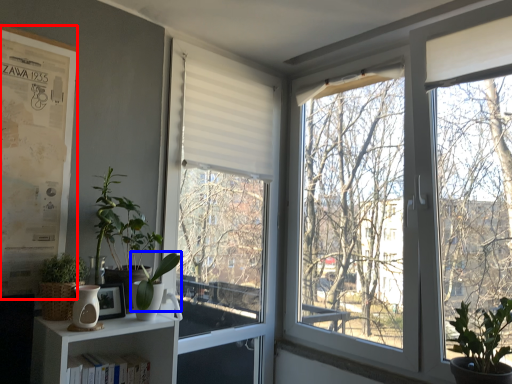
Question: Which object is further to the camera taking this photo, bulletin board (highlighted by a red box) or plant (highlighted by a blue box)?

Choices:
 (A) bulletin board
 (B) plant

Answer: (A)